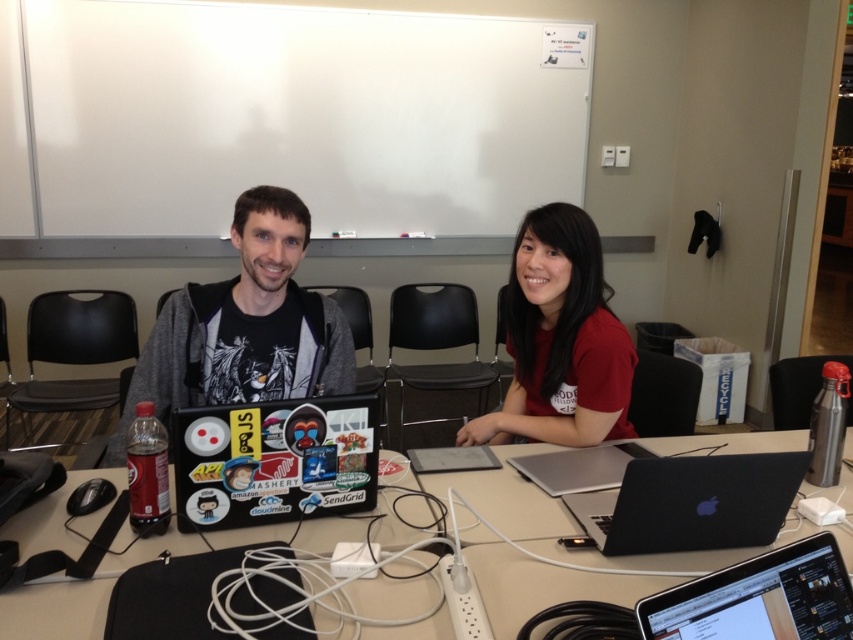
Does matte black laptop at center appear under black matte laptop at center?

Incorrect, matte black laptop at center is not positioned below black matte laptop at center.

Between matte black laptop at center and black matte laptop at center, which one appears on the right side from the viewer's perspective?

Positioned to the right is black matte laptop at center.

Is point (329, 378) closer to camera compared to point (737, 502)?

No.

Where is `matte black laptop at center`? The image size is (853, 640). matte black laptop at center is located at coordinates (244, 326).

Is matte black laptop at center below black plastic laptop at lower right?

No, matte black laptop at center is not below black plastic laptop at lower right.

Which is more to the right, matte black laptop at center or black plastic laptop at lower right?

black plastic laptop at lower right is more to the right.

Is point (283, 298) farther from viewer compared to point (741, 566)?

Yes, it is.

Find the location of a particular element. matte black laptop at center is located at coordinates (244, 326).

Does black plastic table at center appear over matte black laptop at center?

Actually, black plastic table at center is below matte black laptop at center.

Does point (398, 506) lie in front of point (164, 308)?

Yes, it is in front of point (164, 308).

What do you see at coordinates (554, 518) in the screenshot? I see `black plastic table at center` at bounding box center [554, 518].

The width and height of the screenshot is (853, 640). Identify the location of black plastic table at center. click(554, 518).